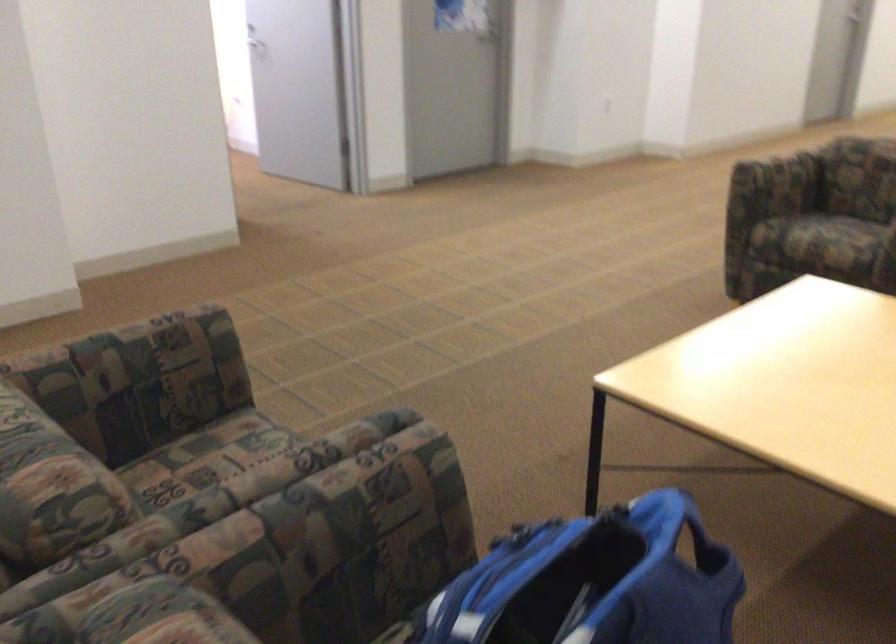
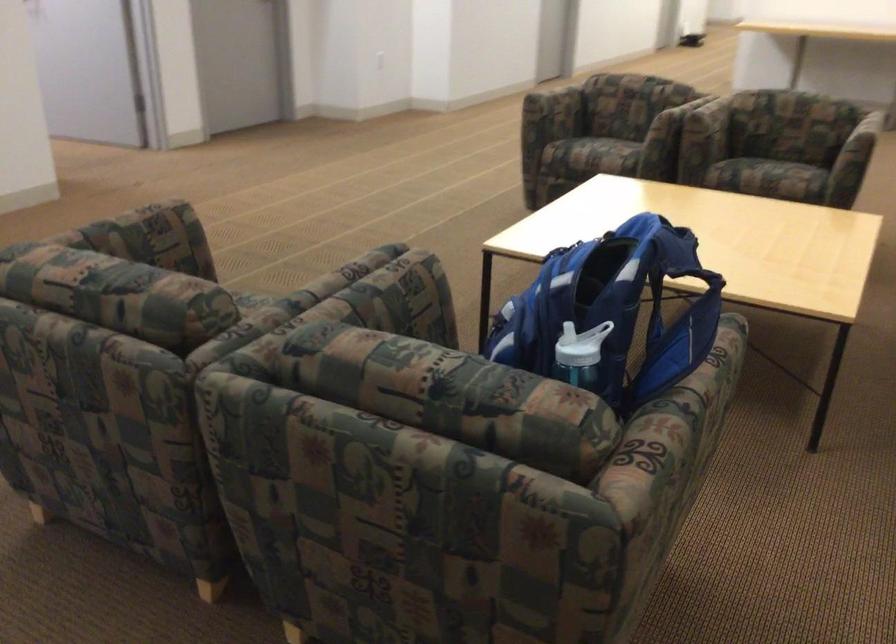
Find the pixel in the second image that matches point (264, 438) in the first image.

(250, 298)